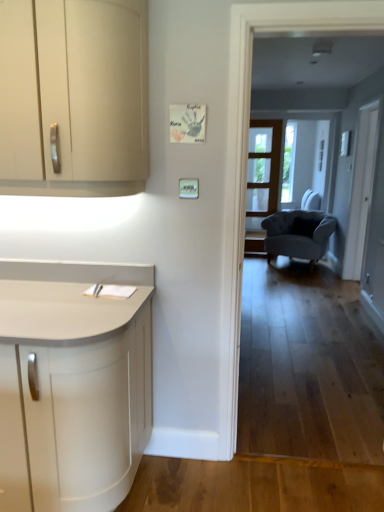
Question: Can you confirm if velvet blue armchair at center is positioned to the left of white glass screen door at right, the 2th screen door positioned from the back?

Choices:
 (A) yes
 (B) no

Answer: (A)

Question: Is velvet blue armchair at center closer to camera compared to white glass screen door at right, arranged as the 1th screen door when viewed from the right?

Choices:
 (A) no
 (B) yes

Answer: (A)

Question: From a real-world perspective, does velvet blue armchair at center stand above white glass screen door at right, arranged as the 1th screen door when viewed from the right?

Choices:
 (A) no
 (B) yes

Answer: (A)

Question: Is velvet blue armchair at center next to white glass screen door at right, which appears as the first screen door when viewed from the front?

Choices:
 (A) yes
 (B) no

Answer: (B)

Question: Does velvet blue armchair at center have a smaller size compared to white glass screen door at right, arranged as the 1th screen door when viewed from the right?

Choices:
 (A) yes
 (B) no

Answer: (B)

Question: Is velvet blue armchair at center far from white glass screen door at right, arranged as the 1th screen door when viewed from the right?

Choices:
 (A) yes
 (B) no

Answer: (B)

Question: Is clear glass screen door at center, marked as the 2th screen door in a right-to-left arrangement, further to the viewer compared to matte cream cabinet at left?

Choices:
 (A) yes
 (B) no

Answer: (A)

Question: Is clear glass screen door at center, which ranks as the 1th screen door in back-to-front order, bigger than matte cream cabinet at left?

Choices:
 (A) no
 (B) yes

Answer: (A)

Question: Can you confirm if clear glass screen door at center, positioned as the first screen door in left-to-right order, is wider than matte cream cabinet at left?

Choices:
 (A) yes
 (B) no

Answer: (B)

Question: Is matte cream cabinet at left at the back of clear glass screen door at center, positioned as the first screen door in left-to-right order?

Choices:
 (A) no
 (B) yes

Answer: (A)

Question: Can you see clear glass screen door at center, the second screen door positioned from the front, touching matte cream cabinet at left?

Choices:
 (A) no
 (B) yes

Answer: (A)

Question: From the image's perspective, is clear glass screen door at center, the second screen door positioned from the front, beneath matte cream cabinet at left?

Choices:
 (A) yes
 (B) no

Answer: (B)

Question: Is matte cream cabinet at left bigger than clear glass screen door at center, the second screen door positioned from the front?

Choices:
 (A) yes
 (B) no

Answer: (A)